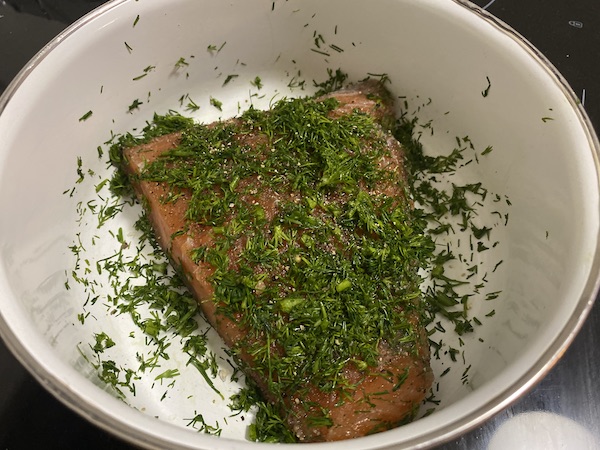
Where is `side of plate`? side of plate is located at coordinates (544, 200).